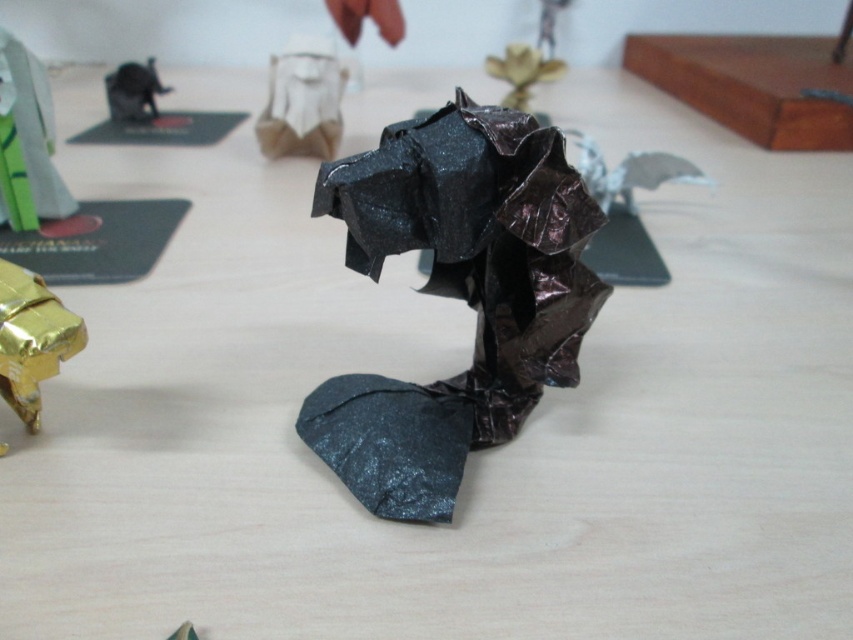
Question: Which object appears closest to the camera in this image?

Choices:
 (A) matte white beard at upper center
 (B) gold foil car at lower left

Answer: (B)

Question: Which point is farther to the camera?

Choices:
 (A) metallic gold origami at center
 (B) shiny metallic bird at center

Answer: (A)

Question: Among these objects, which one is farthest from the camera?

Choices:
 (A) metallic gold origami at center
 (B) shiny metallic bird at center

Answer: (A)

Question: Is shiny black origami elephant at center wider than metallic gold origami at center?

Choices:
 (A) yes
 (B) no

Answer: (A)

Question: Can you confirm if shiny metallic bird at center is positioned below metallic gold origami at center?

Choices:
 (A) yes
 (B) no

Answer: (A)

Question: Can you confirm if metallic gold origami at center is smaller than matte black elephant at upper left?

Choices:
 (A) yes
 (B) no

Answer: (A)